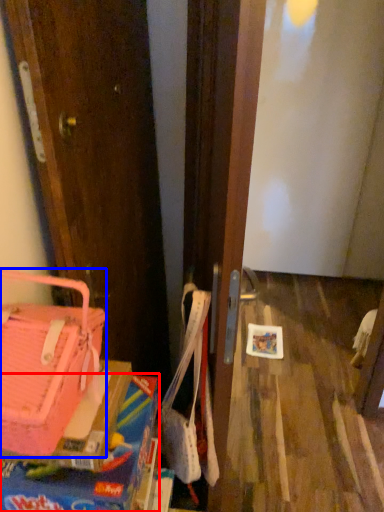
Question: Which of the following is the farthest to the observer, box (highlighted by a red box) or handbag (highlighted by a blue box)?

Choices:
 (A) box
 (B) handbag

Answer: (A)